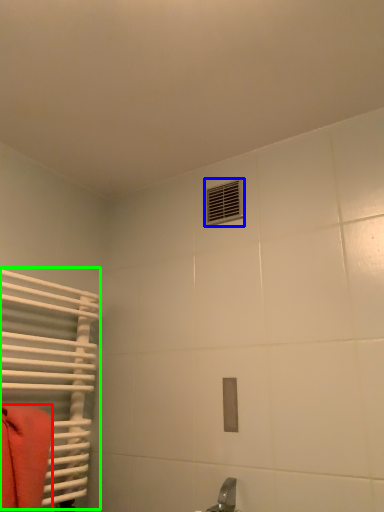
Question: Which object is the farthest from towel (highlighted by a red box)? Choose among these: air conditioning (highlighted by a blue box) or radiator (highlighted by a green box).

Choices:
 (A) air conditioning
 (B) radiator

Answer: (A)